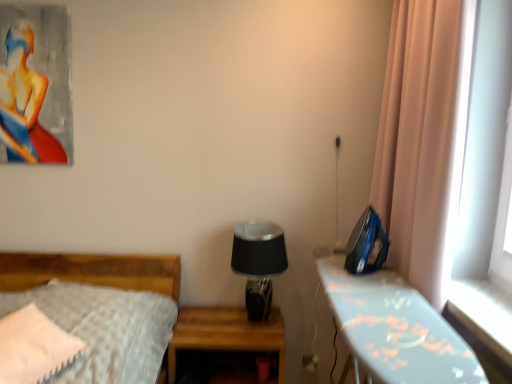
In order to click on white plastic electric outlet at lower center in this screenshot , I will do `click(310, 361)`.

What is the approximate width of blue plastic iron at right, arranged as the 2th nightstand when viewed from the left?

The width of blue plastic iron at right, arranged as the 2th nightstand when viewed from the left, is 37.07 centimeters.

This screenshot has width=512, height=384. Find the location of `wooden nightstand at center, which is the second nightstand in right-to-left order`. wooden nightstand at center, which is the second nightstand in right-to-left order is located at coordinates (226, 333).

Where is `white plastic electric outlet at lower center`? The image size is (512, 384). white plastic electric outlet at lower center is located at coordinates (310, 361).

Considering the relative sizes of wooden nightstand at center, which is the second nightstand in right-to-left order, and white fluffy pillow at lower left in the image provided, is wooden nightstand at center, which is the second nightstand in right-to-left order, smaller than white fluffy pillow at lower left?

No.

In terms of width, does wooden nightstand at center, which is the second nightstand in right-to-left order, look wider or thinner when compared to white fluffy pillow at lower left?

Clearly, wooden nightstand at center, which is the second nightstand in right-to-left order, has more width compared to white fluffy pillow at lower left.

From a real-world perspective, which object rests below the other?

wooden nightstand at center, which is the second nightstand in right-to-left order, is physically lower.

Would you consider wooden nightstand at center, which is the second nightstand in right-to-left order, to be distant from white fluffy pillow at lower left?

No, there isn't a large distance between wooden nightstand at center, which is the second nightstand in right-to-left order, and white fluffy pillow at lower left.

How much distance is there between matte acrylic painting of a woman at upper left and blue plastic iron at right, arranged as the 2th nightstand when viewed from the left?

5.77 feet.

In the scene shown: From a real-world perspective, between matte acrylic painting of a woman at upper left and blue plastic iron at right, arranged as the 2th nightstand when viewed from the left, who is vertically higher?

matte acrylic painting of a woman at upper left, from a real-world perspective.

Which object is further away from the camera, matte acrylic painting of a woman at upper left or blue plastic iron at right, which is the first nightstand in right-to-left order?

matte acrylic painting of a woman at upper left.

Considering the relative positions of matte acrylic painting of a woman at upper left and blue plastic iron at right, arranged as the 2th nightstand when viewed from the left, in the image provided, is matte acrylic painting of a woman at upper left to the left of blue plastic iron at right, arranged as the 2th nightstand when viewed from the left, from the viewer's perspective?

Yes, matte acrylic painting of a woman at upper left is to the left of blue plastic iron at right, arranged as the 2th nightstand when viewed from the left.

From their relative heights in the image, would you say black glass table lamp at center is taller or shorter than blue plastic iron at right, which is the first nightstand in right-to-left order?

In the image, black glass table lamp at center appears to be shorter than blue plastic iron at right, which is the first nightstand in right-to-left order.

Is black glass table lamp at center completely or partially outside of blue plastic iron at right, arranged as the 2th nightstand when viewed from the left?

Indeed, black glass table lamp at center is completely outside blue plastic iron at right, arranged as the 2th nightstand when viewed from the left.

Which is in front, black glass table lamp at center or blue plastic iron at right, which is the first nightstand in right-to-left order?

blue plastic iron at right, which is the first nightstand in right-to-left order, is in front.

Which of these two, black glass table lamp at center or blue plastic iron at right, arranged as the 2th nightstand when viewed from the left, is bigger?

blue plastic iron at right, arranged as the 2th nightstand when viewed from the left, is bigger.

From the image's perspective, is black glass table lamp at center above white plastic electric outlet at lower center?

Correct, black glass table lamp at center appears higher than white plastic electric outlet at lower center in the image.

Is black glass table lamp at center aimed at white plastic electric outlet at lower center?

No, black glass table lamp at center is not aimed at white plastic electric outlet at lower center.

Is the position of black glass table lamp at center less distant than that of white plastic electric outlet at lower center?

That is True.

Which is in front, point (260, 314) or point (302, 358)?

Point (260, 314)

From a real-world perspective, relative to white plastic electric outlet at lower center, is matte acrylic painting of a woman at upper left vertically above or below?

In terms of real-world spatial position, matte acrylic painting of a woman at upper left is above white plastic electric outlet at lower center.

Does matte acrylic painting of a woman at upper left have a larger size compared to white plastic electric outlet at lower center?

Yes, matte acrylic painting of a woman at upper left is bigger than white plastic electric outlet at lower center.

Does matte acrylic painting of a woman at upper left appear on the left side of white plastic electric outlet at lower center?

Indeed, matte acrylic painting of a woman at upper left is positioned on the left side of white plastic electric outlet at lower center.

Between matte acrylic painting of a woman at upper left and white plastic electric outlet at lower center, which one is positioned behind?

white plastic electric outlet at lower center is behind.

Considering the sizes of black glass table lamp at center and wooden nightstand at center, which is the second nightstand in right-to-left order, in the image, is black glass table lamp at center taller or shorter than wooden nightstand at center, which is the second nightstand in right-to-left order,?

black glass table lamp at center is taller than wooden nightstand at center, which is the second nightstand in right-to-left order.

From a real-world perspective, who is located higher, black glass table lamp at center or wooden nightstand at center, which is the second nightstand in right-to-left order?

black glass table lamp at center, from a real-world perspective.

Could you tell me if black glass table lamp at center is facing wooden nightstand at center, the first nightstand in the left-to-right sequence?

No, black glass table lamp at center is not facing towards wooden nightstand at center, the first nightstand in the left-to-right sequence.

Would you say black glass table lamp at center is a long distance from wooden nightstand at center, the first nightstand in the left-to-right sequence?

No, black glass table lamp at center is not far from wooden nightstand at center, the first nightstand in the left-to-right sequence.

Is there a large distance between wooden nightstand at center, the first nightstand in the left-to-right sequence, and black glass table lamp at center?

They are positioned close to each other.

Which is correct: wooden nightstand at center, the first nightstand in the left-to-right sequence, is inside black glass table lamp at center, or outside of it?

A: The correct answer is: outside.

Can you confirm if wooden nightstand at center, which is the second nightstand in right-to-left order, is shorter than black glass table lamp at center?

Correct, wooden nightstand at center, which is the second nightstand in right-to-left order, is not as tall as black glass table lamp at center.

In the scene shown: Is wooden nightstand at center, the first nightstand in the left-to-right sequence, positioned with its back to black glass table lamp at center?

No, wooden nightstand at center, the first nightstand in the left-to-right sequence, is not facing the opposite direction of black glass table lamp at center.

Locate an element on the screen. This screenshot has width=512, height=384. pillow located above the wooden nightstand at center, the first nightstand in the left-to-right sequence (from the image's perspective) is located at coordinates (34, 347).

The image size is (512, 384). I want to click on the 1st nightstand positioned below the matte acrylic painting of a woman at upper left (from a real-world perspective), so coord(396,329).

When comparing their distances from white fluffy pillow at lower left, does blue plastic iron at right, arranged as the 2th nightstand when viewed from the left, or white plastic electric outlet at lower center seem further?

The object further to white fluffy pillow at lower left is white plastic electric outlet at lower center.

Considering their positions, is matte acrylic painting of a woman at upper left positioned closer to blue plastic iron at right, which is the first nightstand in right-to-left order, than wooden nightstand at center, the first nightstand in the left-to-right sequence?

wooden nightstand at center, the first nightstand in the left-to-right sequence, lies closer to blue plastic iron at right, which is the first nightstand in right-to-left order, than the other object.

Looking at the image, which one is located closer to wooden nightstand at center, which is the second nightstand in right-to-left order, matte acrylic painting of a woman at upper left or white fluffy pillow at lower left?

white fluffy pillow at lower left is closer to wooden nightstand at center, which is the second nightstand in right-to-left order.

From the picture: Considering their positions, is white fluffy pillow at lower left positioned closer to wooden nightstand at center, the first nightstand in the left-to-right sequence, than white plastic electric outlet at lower center?

white plastic electric outlet at lower center lies closer to wooden nightstand at center, the first nightstand in the left-to-right sequence, than the other object.

Considering their positions, is white fluffy pillow at lower left positioned closer to white plastic electric outlet at lower center than matte acrylic painting of a woman at upper left?

white fluffy pillow at lower left lies closer to white plastic electric outlet at lower center than the other object.

From the image, which object appears to be farther from black glass table lamp at center, white fluffy pillow at lower left or matte acrylic painting of a woman at upper left?

matte acrylic painting of a woman at upper left is positioned further to the anchor black glass table lamp at center.

When comparing their distances from wooden nightstand at center, which is the second nightstand in right-to-left order, does blue plastic iron at right, which is the first nightstand in right-to-left order, or white plastic electric outlet at lower center seem closer?

Among the two, white plastic electric outlet at lower center is located nearer to wooden nightstand at center, which is the second nightstand in right-to-left order.

Estimate the real-world distances between objects in this image. Which object is closer to wooden nightstand at center, the first nightstand in the left-to-right sequence, matte acrylic painting of a woman at upper left or white plastic electric outlet at lower center?

white plastic electric outlet at lower center lies closer to wooden nightstand at center, the first nightstand in the left-to-right sequence, than the other object.

I want to click on pillow located between blue plastic iron at right, arranged as the 2th nightstand when viewed from the left, and white plastic electric outlet at lower center in the depth direction, so click(34, 347).

Image resolution: width=512 pixels, height=384 pixels. I want to click on nightstand located between white fluffy pillow at lower left and blue plastic iron at right, which is the first nightstand in right-to-left order, in the left-right direction, so click(226, 333).

Where is `table lamp between matte acrylic painting of a woman at upper left and blue plastic iron at right, arranged as the 2th nightstand when viewed from the left`? table lamp between matte acrylic painting of a woman at upper left and blue plastic iron at right, arranged as the 2th nightstand when viewed from the left is located at coordinates (258, 263).

The width and height of the screenshot is (512, 384). I want to click on table lamp between white fluffy pillow at lower left and blue plastic iron at right, which is the first nightstand in right-to-left order, from left to right, so pos(258,263).